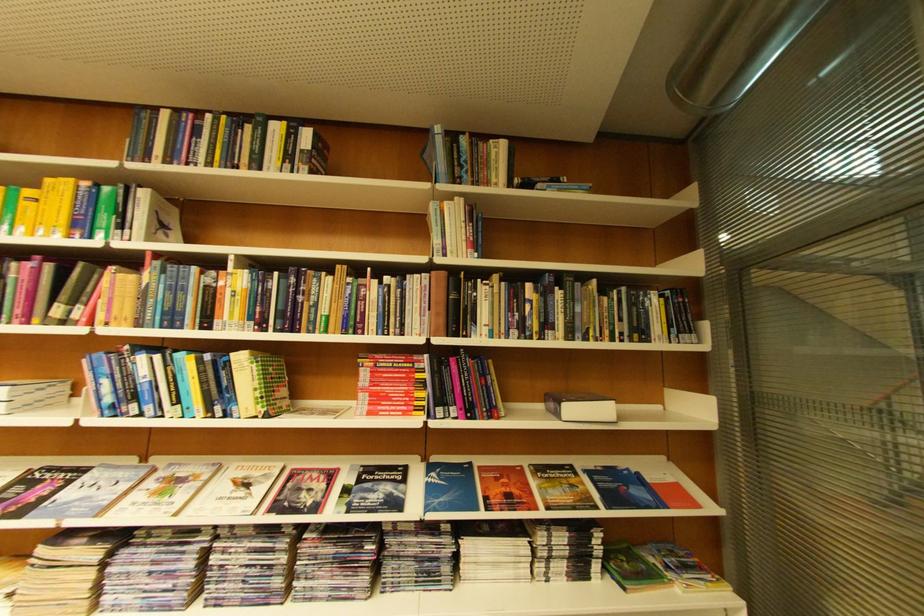
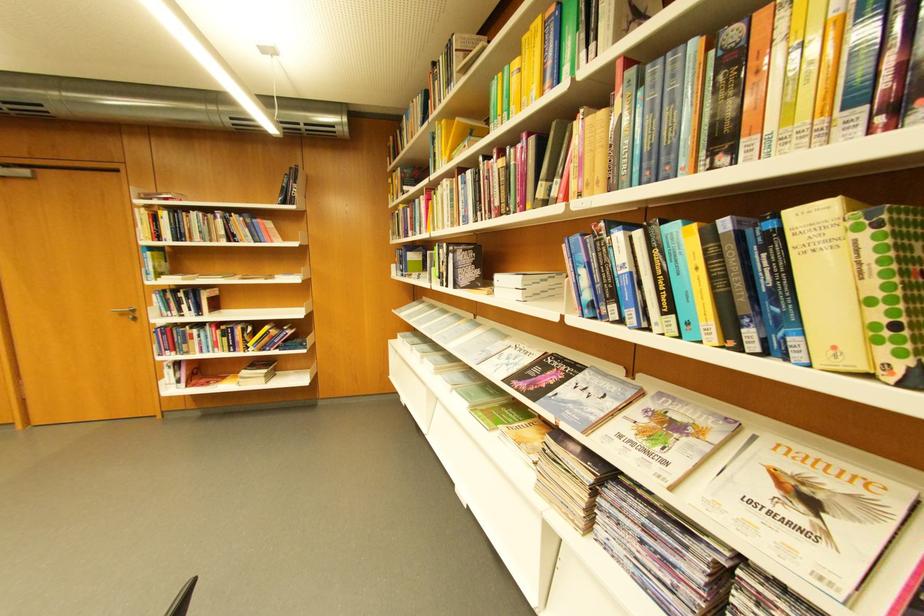
Locate, in the second image, the point that corresponds to point 251,477 in the first image.

(800, 469)